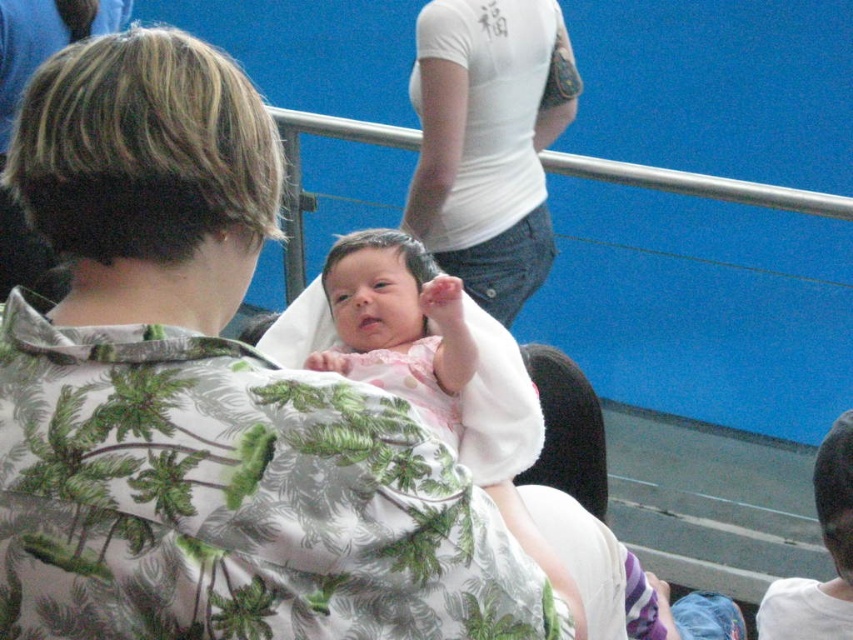
Question: Is soft pink fabric baby at center further to the viewer compared to pink fabric newborn at center?

Choices:
 (A) no
 (B) yes

Answer: (A)

Question: Which point is closer to the camera taking this photo?

Choices:
 (A) (416, 355)
 (B) (523, 36)

Answer: (A)

Question: Estimate the real-world distances between objects in this image. Which object is closer to the pink fabric newborn at center?

Choices:
 (A) soft pink fabric baby at center
 (B) white matte t-shirt at upper center

Answer: (A)

Question: Can you confirm if white matte t-shirt at upper center is smaller than soft pink fabric baby at center?

Choices:
 (A) yes
 (B) no

Answer: (A)

Question: Is the position of white cotton shirt at center more distant than that of pink fabric newborn at center?

Choices:
 (A) no
 (B) yes

Answer: (A)

Question: Which point appears closest to the camera in this image?

Choices:
 (A) (194, 177)
 (B) (346, 276)

Answer: (A)